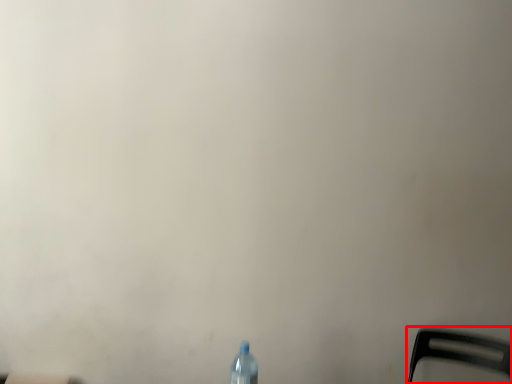
Question: Observing the image, what is the correct spatial positioning of chair (annotated by the red box) in reference to bottle?

Choices:
 (A) right
 (B) left

Answer: (A)